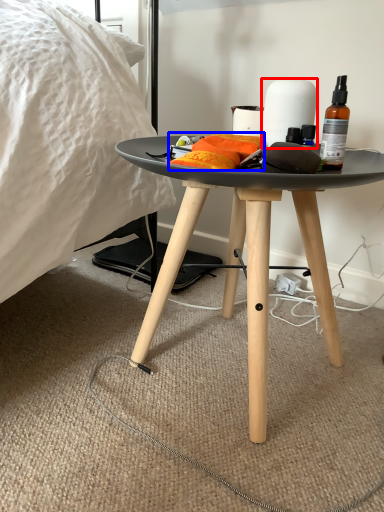
Question: Among these objects, which one is nearest to the camera, paper towel (highlighted by a red box) or material (highlighted by a blue box)?

Choices:
 (A) paper towel
 (B) material

Answer: (B)